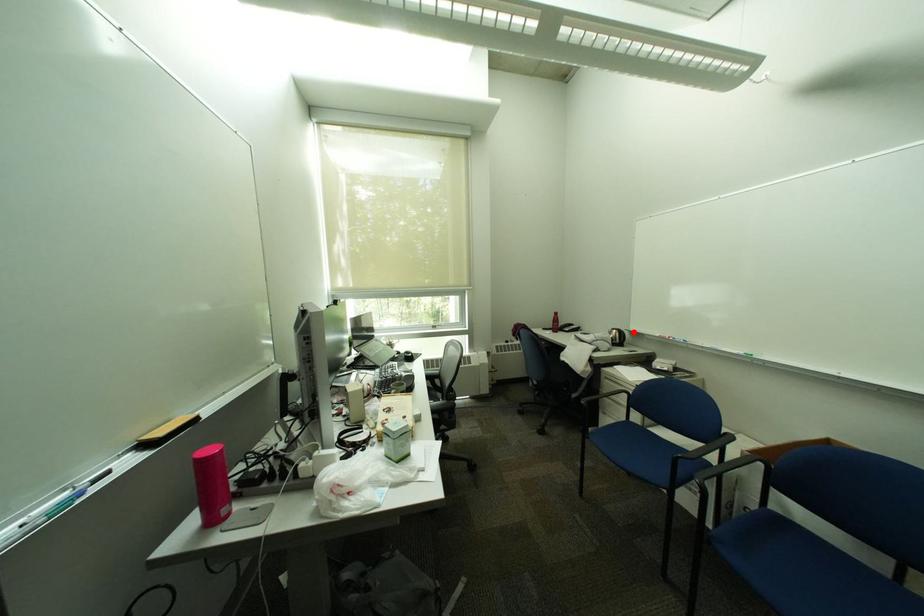
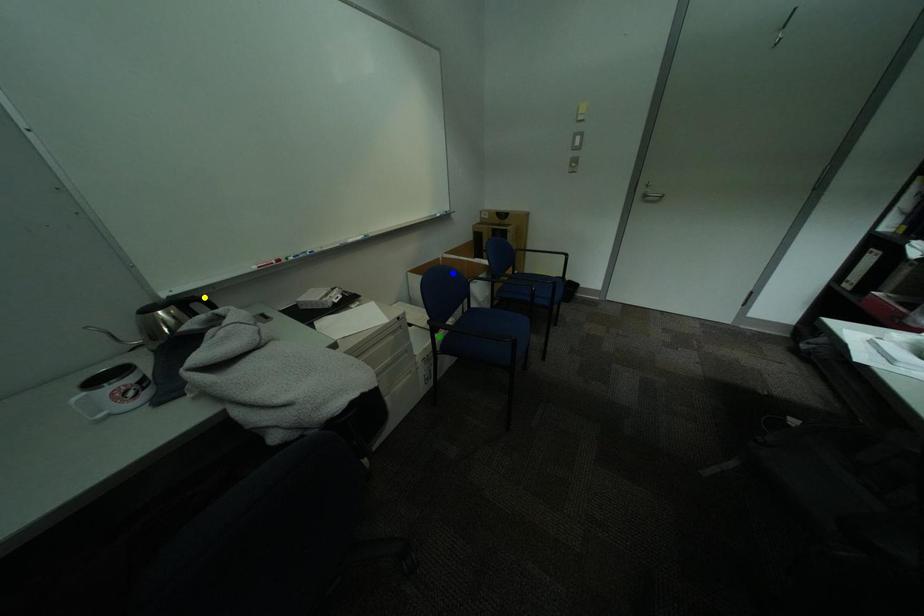
Question: I am providing you with two images of the same scene from different viewpoints. A red point is marked on the first image. You are given multiple points on the second image. In image 2, which mark is for the same physical point as the one in image 1?

Choices:
 (A) yellow point
 (B) blue point
 (C) green point

Answer: (A)